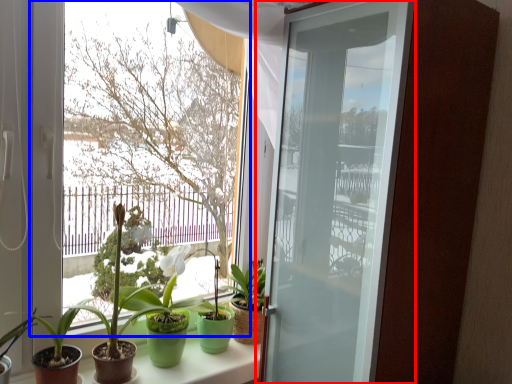
Question: Which of the following is the farthest to the observer, door (highlighted by a red box) or window (highlighted by a blue box)?

Choices:
 (A) door
 (B) window

Answer: (B)